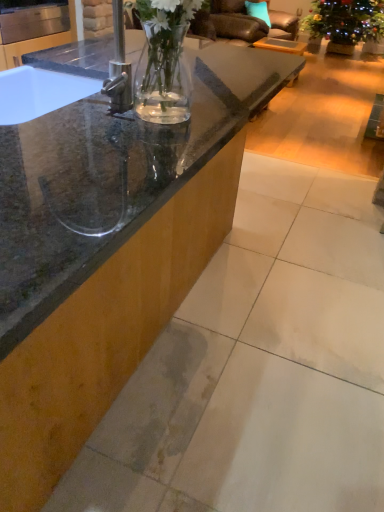
Question: From the image's perspective, is green leafy plant at upper right located beneath teal fabric pillow at upper center?

Choices:
 (A) no
 (B) yes

Answer: (A)

Question: Is green leafy plant at upper right taller than teal fabric pillow at upper center?

Choices:
 (A) yes
 (B) no

Answer: (A)

Question: Does green leafy plant at upper right have a greater width compared to teal fabric pillow at upper center?

Choices:
 (A) no
 (B) yes

Answer: (B)

Question: Is green leafy plant at upper right not close to teal fabric pillow at upper center?

Choices:
 (A) yes
 (B) no

Answer: (A)

Question: Could you tell me if green leafy plant at upper right is facing teal fabric pillow at upper center?

Choices:
 (A) no
 (B) yes

Answer: (B)

Question: Is translucent glass sink at upper left spatially inside leather armchair at upper center, or outside of it?

Choices:
 (A) outside
 (B) inside

Answer: (A)

Question: In terms of width, does translucent glass sink at upper left look wider or thinner when compared to leather armchair at upper center?

Choices:
 (A) thin
 (B) wide

Answer: (A)

Question: In the image, is translucent glass sink at upper left positioned in front of or behind leather armchair at upper center?

Choices:
 (A) front
 (B) behind

Answer: (A)

Question: From a real-world perspective, relative to leather armchair at upper center, is translucent glass sink at upper left vertically above or below?

Choices:
 (A) above
 (B) below

Answer: (A)

Question: Is point (317, 30) closer or farther from the camera than point (235, 28)?

Choices:
 (A) closer
 (B) farther

Answer: (B)

Question: From their relative heights in the image, would you say green leafy plant at upper right is taller or shorter than leather armchair at upper center?

Choices:
 (A) short
 (B) tall

Answer: (B)

Question: Is green leafy plant at upper right spatially inside leather armchair at upper center, or outside of it?

Choices:
 (A) inside
 (B) outside

Answer: (B)

Question: From the image's perspective, is green leafy plant at upper right positioned above or below leather armchair at upper center?

Choices:
 (A) above
 (B) below

Answer: (A)

Question: Considering the positions of wooden table at center and teal fabric pillow at upper center in the image, is wooden table at center taller or shorter than teal fabric pillow at upper center?

Choices:
 (A) short
 (B) tall

Answer: (B)

Question: From a real-world perspective, is wooden table at center positioned above or below teal fabric pillow at upper center?

Choices:
 (A) above
 (B) below

Answer: (B)